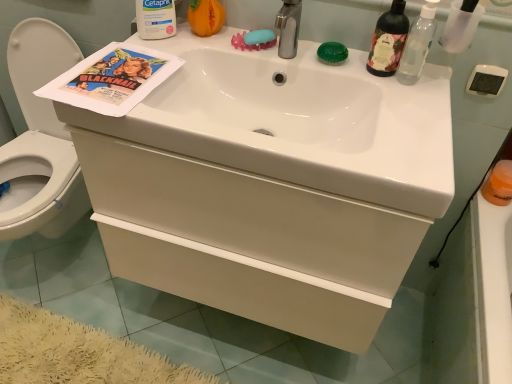
Locate an element on the screen. free space in front of white glossy toilet at left is located at coordinates (62, 336).